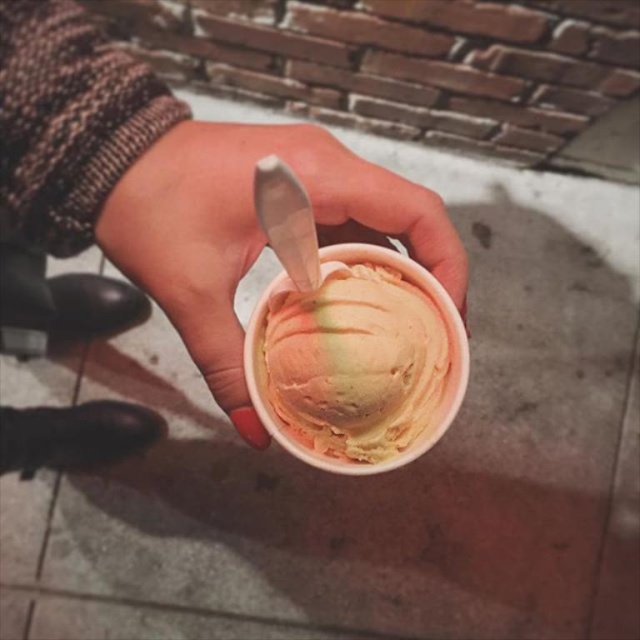
Question: Which point appears closest to the camera in this image?

Choices:
 (A) (392, 330)
 (B) (356, 237)

Answer: (A)

Question: Is matte plastic cup at center below pastel swirl ice cream at center?

Choices:
 (A) yes
 (B) no

Answer: (B)

Question: Is matte plastic cup at center positioned before pastel swirl ice cream at center?

Choices:
 (A) no
 (B) yes

Answer: (A)

Question: Does matte plastic cup at center come in front of pastel swirl ice cream at center?

Choices:
 (A) no
 (B) yes

Answer: (A)